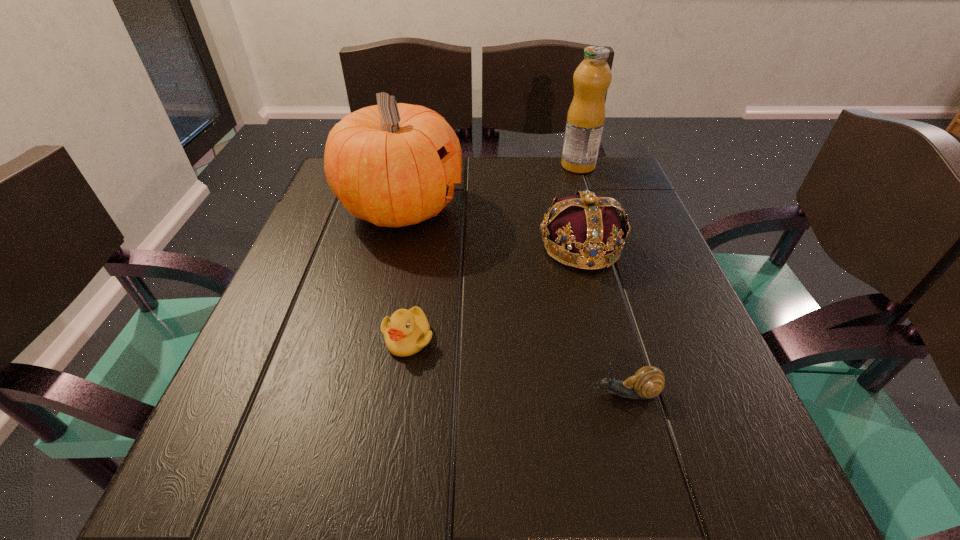
The width and height of the screenshot is (960, 540). I want to click on unoccupied area between the pumpkin and the second shortest object, so click(x=404, y=273).

This screenshot has height=540, width=960. Identify the location of free spot between the nearest object and the pumpkin. (514, 301).

Find the location of a particular element. free area in between the shortest object and the pumpkin is located at coordinates (514, 301).

Locate an element on the screen. empty space that is in between the duckling and the shortest object is located at coordinates click(516, 366).

Where is `vacant area between the duckling and the pumpkin`? The width and height of the screenshot is (960, 540). vacant area between the duckling and the pumpkin is located at coordinates (404, 273).

At what (x,y) coordinates should I click in order to perform the action: click on unoccupied area between the shortest object and the pumpkin. Please return your answer as a coordinate pair (x, y). Looking at the image, I should click on (514, 301).

Identify the location of empty space between the shortest object and the duckling. This screenshot has height=540, width=960. (516, 366).

The width and height of the screenshot is (960, 540). In order to click on unoccupied position between the fourth tallest object and the escargot in this screenshot , I will do `click(516, 366)`.

Image resolution: width=960 pixels, height=540 pixels. I want to click on unoccupied position between the fourth tallest object and the escargot, so click(516, 366).

Find the location of a particular element. This screenshot has height=540, width=960. the second closest object to the pumpkin is located at coordinates (406, 332).